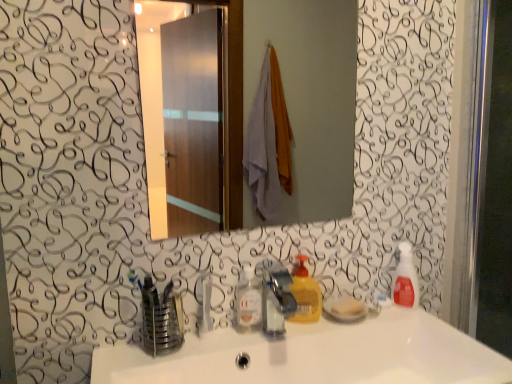
Question: In terms of width, does satin nickel faucet at center look wider or thinner when compared to metallic reflective mirror at center?

Choices:
 (A) thin
 (B) wide

Answer: (B)

Question: Considering the positions of satin nickel faucet at center and metallic reflective mirror at center in the image, is satin nickel faucet at center taller or shorter than metallic reflective mirror at center?

Choices:
 (A) tall
 (B) short

Answer: (B)

Question: Estimate the real-world distances between objects in this image. Which object is farther from the yellow matte liquid soap at center?

Choices:
 (A) clear plastic bottle at center
 (B) translucent plastic soap dispenser at right
 (C) metallic reflective mirror at center
 (D) satin nickel faucet at center
 (E) white glossy sink at center

Answer: (C)

Question: Estimate the real-world distances between objects in this image. Which object is farther from the white glossy sink at center?

Choices:
 (A) satin nickel faucet at center
 (B) metallic reflective mirror at center
 (C) clear plastic bottle at center
 (D) translucent plastic soap dispenser at right
 (E) yellow matte liquid soap at center

Answer: (B)